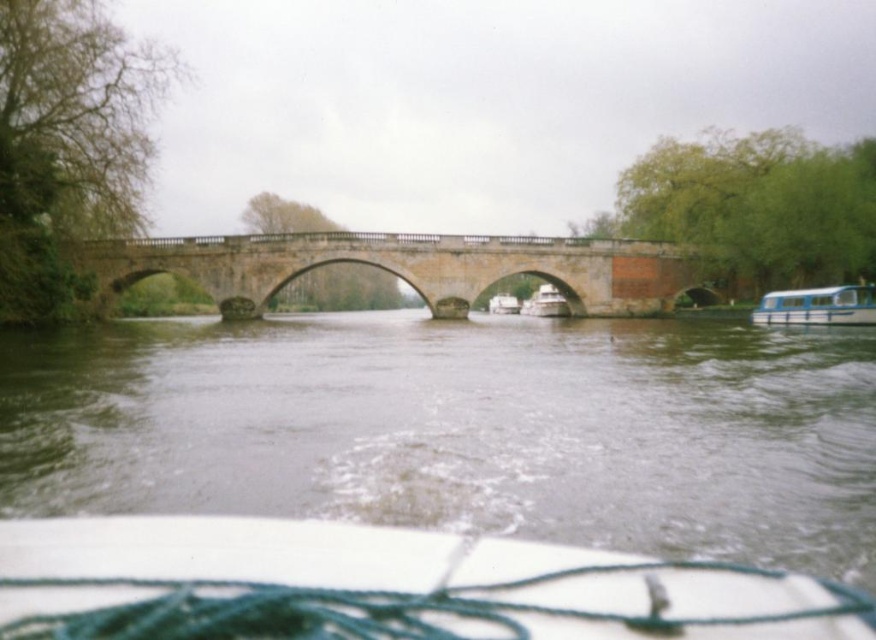
Does point (564, 596) come closer to viewer compared to point (537, 300)?

Yes, it is.

Is white matte boat at center to the left of white glossy boat at center from the viewer's perspective?

Yes, white matte boat at center is to the left of white glossy boat at center.

Does point (492, 598) come in front of point (527, 312)?

Yes.

Where is `white matte boat at center`? The image size is (876, 640). white matte boat at center is located at coordinates (383, 586).

Is greenish water at center shorter than stone bridge at center?

Correct, greenish water at center is not as tall as stone bridge at center.

Is greenish water at center above stone bridge at center?

No, greenish water at center is not above stone bridge at center.

Is point (606, 380) positioned after point (378, 243)?

No, (606, 380) is closer to viewer.

Locate an element on the screen. greenish water at center is located at coordinates [461, 428].

Looking at this image, is white glossy boat at right further to camera compared to white plastic boat at center?

No, it is in front of white plastic boat at center.

Is white glossy boat at right thinner than white plastic boat at center?

No.

Is point (860, 324) in front of point (500, 296)?

Yes, it is.

Image resolution: width=876 pixels, height=640 pixels. Identify the location of white glossy boat at right. (818, 307).